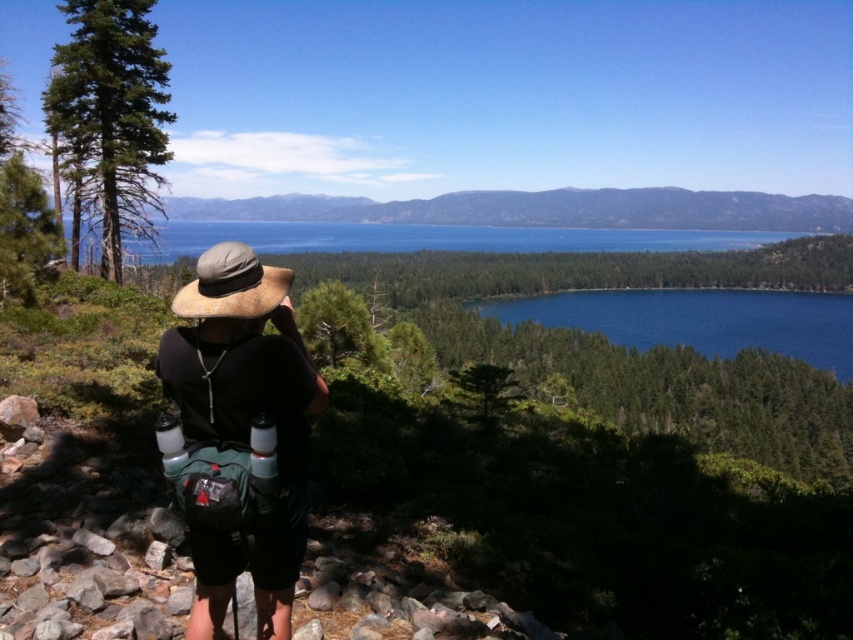
Between blue glassy water at center and blue water at center, which one appears on the right side from the viewer's perspective?

blue glassy water at center

Does blue glassy water at center have a greater height compared to blue water at center?

In fact, blue glassy water at center may be shorter than blue water at center.

Is point (637, 300) positioned after point (288, 224)?

No, (637, 300) is in front of (288, 224).

At what (x,y) coordinates should I click in order to perform the action: click on blue glassy water at center. Please return your answer as a coordinate pair (x, y). Looking at the image, I should click on coord(699,321).

Between point (251, 316) and point (848, 314), which one is positioned in front?

Point (251, 316) is in front.

Which of these two, dark green backpack at center or blue glassy water at center, stands shorter?

dark green backpack at center

Describe the element at coordinates (242, 426) in the screenshot. This screenshot has height=640, width=853. I see `dark green backpack at center` at that location.

I want to click on dark green backpack at center, so click(x=242, y=426).

Is dark green backpack at center taller than blue water at center?

No.

What do you see at coordinates (242, 426) in the screenshot? The image size is (853, 640). I see `dark green backpack at center` at bounding box center [242, 426].

Where is `dark green backpack at center`? The height and width of the screenshot is (640, 853). dark green backpack at center is located at coordinates (242, 426).